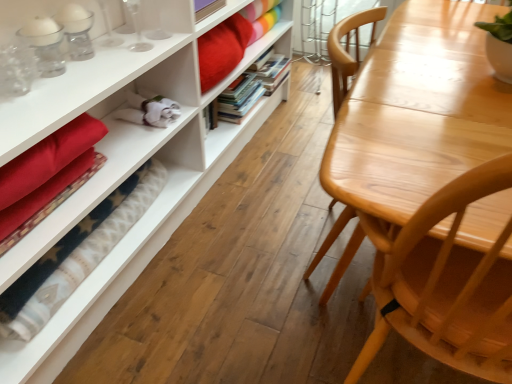
Question: Which is correct: velvet red blanket at lower left is inside matte white bookcase at left, or outside of it?

Choices:
 (A) inside
 (B) outside

Answer: (B)

Question: Considering the positions of velvet red blanket at lower left and matte white bookcase at left in the image, is velvet red blanket at lower left bigger or smaller than matte white bookcase at left?

Choices:
 (A) small
 (B) big

Answer: (A)

Question: Estimate the real-world distances between objects in this image. Which object is farther from the light wood table at right?

Choices:
 (A) velvet red blanket at lower left
 (B) hardcover books at center, positioned as the first book in front-to-back order
 (C) hardcover books at center, the 2th book viewed from the front
 (D) matte white bookcase at left

Answer: (C)

Question: Estimate the real-world distances between objects in this image. Which object is closer to the velvet red blanket at lower left?

Choices:
 (A) hardcover books at center, arranged as the second book when viewed from the back
 (B) hardcover books at center, arranged as the first book when viewed from the back
 (C) matte white bookcase at left
 (D) light wood table at right

Answer: (C)